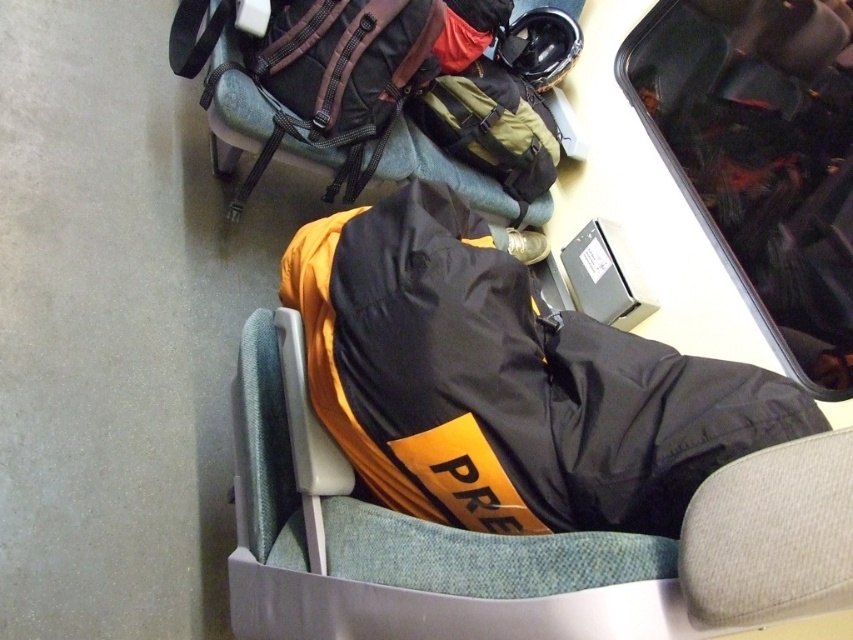
Who is positioned more to the right, black fabric jacket at center or black matte suitcase at upper right?

From the viewer's perspective, black matte suitcase at upper right appears more on the right side.

Does black fabric jacket at center have a greater width compared to black matte suitcase at upper right?

Yes.

Is point (396, 609) in front of point (631, 67)?

Yes.

Find the location of a particular element. This screenshot has height=640, width=853. black fabric jacket at center is located at coordinates (514, 544).

The height and width of the screenshot is (640, 853). Describe the element at coordinates (761, 156) in the screenshot. I see `black matte suitcase at upper right` at that location.

Which is more to the right, black matte suitcase at upper right or matte green backpack at center?

Positioned to the right is black matte suitcase at upper right.

Between point (817, 6) and point (489, 131), which one is positioned behind?

Positioned behind is point (489, 131).

Image resolution: width=853 pixels, height=640 pixels. I want to click on black matte suitcase at upper right, so click(761, 156).

Can you confirm if black matte jacket at center is positioned to the right of black fabric jacket at center?

Correct, you'll find black matte jacket at center to the right of black fabric jacket at center.

Does point (308, 336) come closer to viewer compared to point (503, 577)?

No, (308, 336) is further to viewer.

The image size is (853, 640). Identify the location of black matte jacket at center. (508, 381).